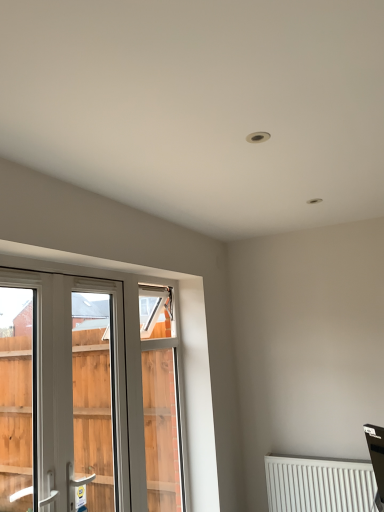
Question: From a real-world perspective, does white plastic window at left sit lower than white plastic screen door at left?

Choices:
 (A) yes
 (B) no

Answer: (B)

Question: Is white plastic window at left wider than white plastic screen door at left?

Choices:
 (A) no
 (B) yes

Answer: (A)

Question: Is white plastic screen door at left inside white plastic window at left?

Choices:
 (A) no
 (B) yes

Answer: (A)

Question: Could you tell me if white plastic window at left is facing white plastic screen door at left?

Choices:
 (A) no
 (B) yes

Answer: (B)

Question: Does white plastic window at left have a lesser width compared to white plastic screen door at left?

Choices:
 (A) no
 (B) yes

Answer: (B)

Question: Is white plastic window at left far from white plastic screen door at left?

Choices:
 (A) no
 (B) yes

Answer: (B)

Question: From the image's perspective, is white plastic screen door at left over white plastic window at left?

Choices:
 (A) yes
 (B) no

Answer: (B)

Question: Does white plastic screen door at left lie behind white plastic window at left?

Choices:
 (A) yes
 (B) no

Answer: (A)

Question: Is white plastic screen door at left at the left side of white plastic window at left?

Choices:
 (A) no
 (B) yes

Answer: (A)

Question: Is white plastic screen door at left shorter than white plastic window at left?

Choices:
 (A) no
 (B) yes

Answer: (B)

Question: Considering the relative sizes of white plastic screen door at left and white plastic window at left in the image provided, is white plastic screen door at left wider than white plastic window at left?

Choices:
 (A) no
 (B) yes

Answer: (B)

Question: From a real-world perspective, is white plastic screen door at left physically above white plastic window at left?

Choices:
 (A) no
 (B) yes

Answer: (A)

Question: Considering the relative positions of white matte radiator at lower right and white plastic screen door at left in the image provided, is white matte radiator at lower right to the right of white plastic screen door at left from the viewer's perspective?

Choices:
 (A) yes
 (B) no

Answer: (A)